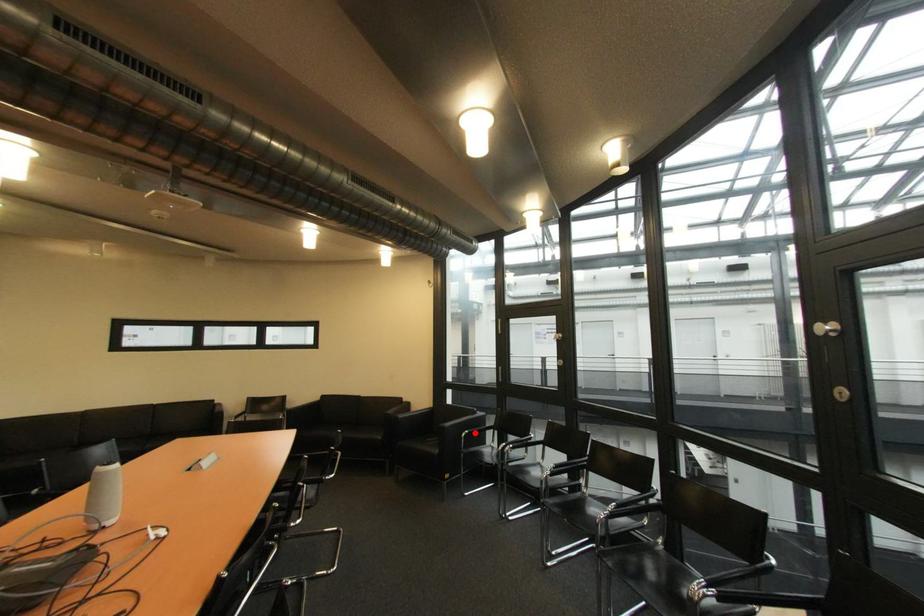
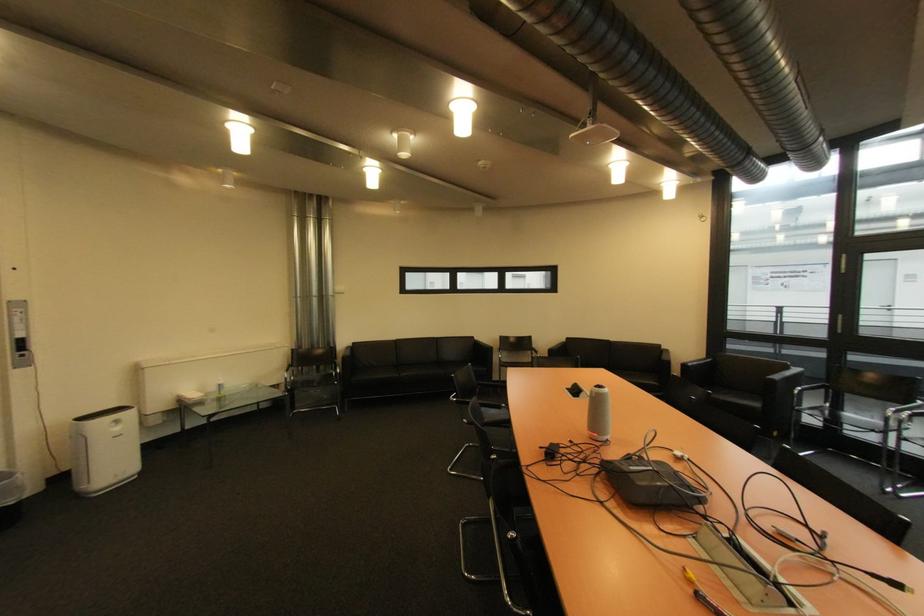
Question: I am providing you with two images of the same scene from different viewpoints. In image1, a red point is highlighted. Considering the same 3D point in image2, which of the following is correct?

Choices:
 (A) It is closer
 (B) It is farther

Answer: (A)